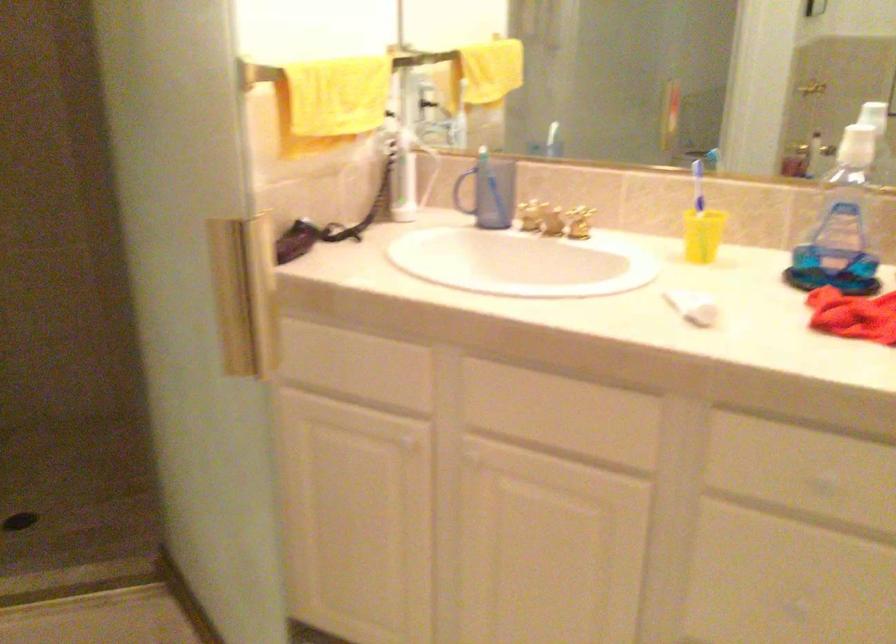
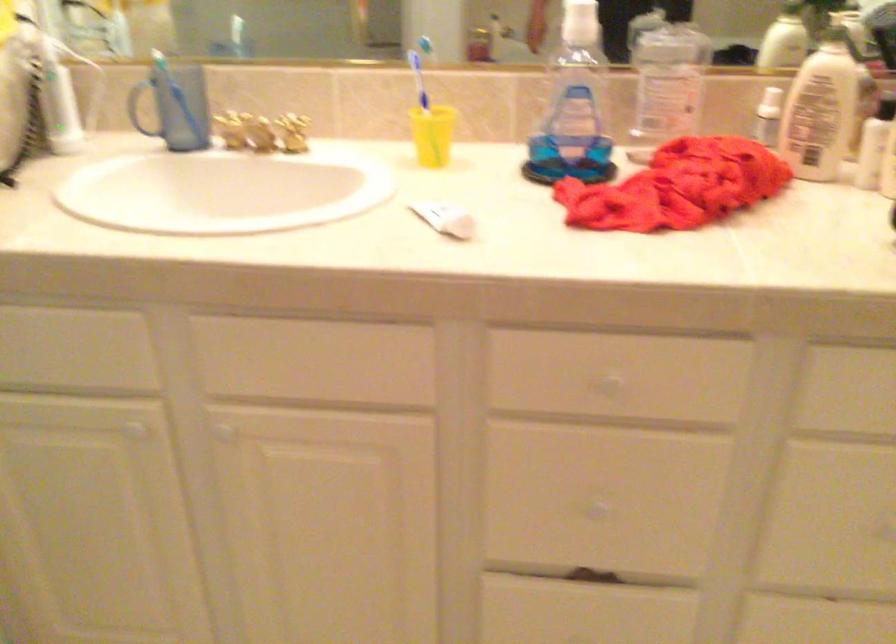
In the second image, find the point that corresponds to [457,189] in the first image.

(140, 106)